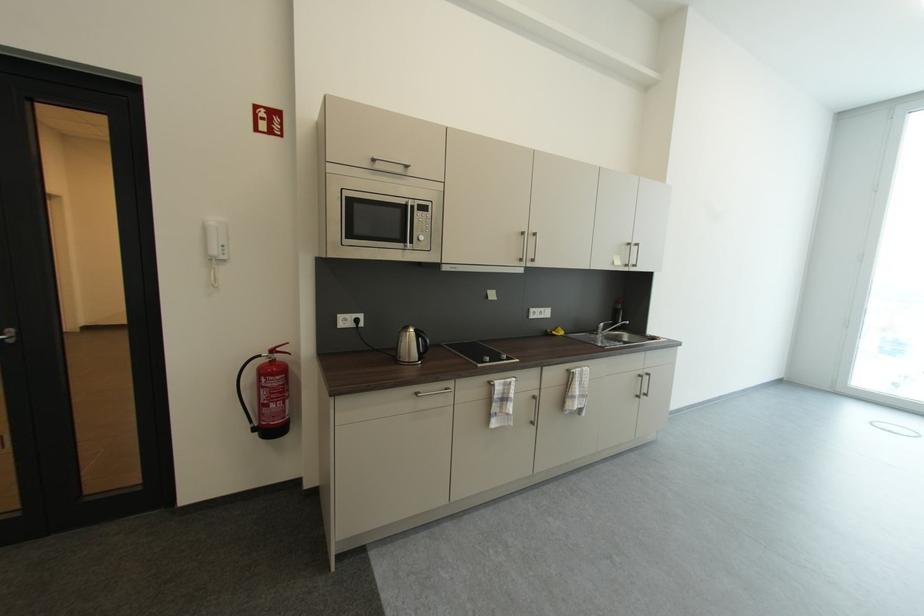
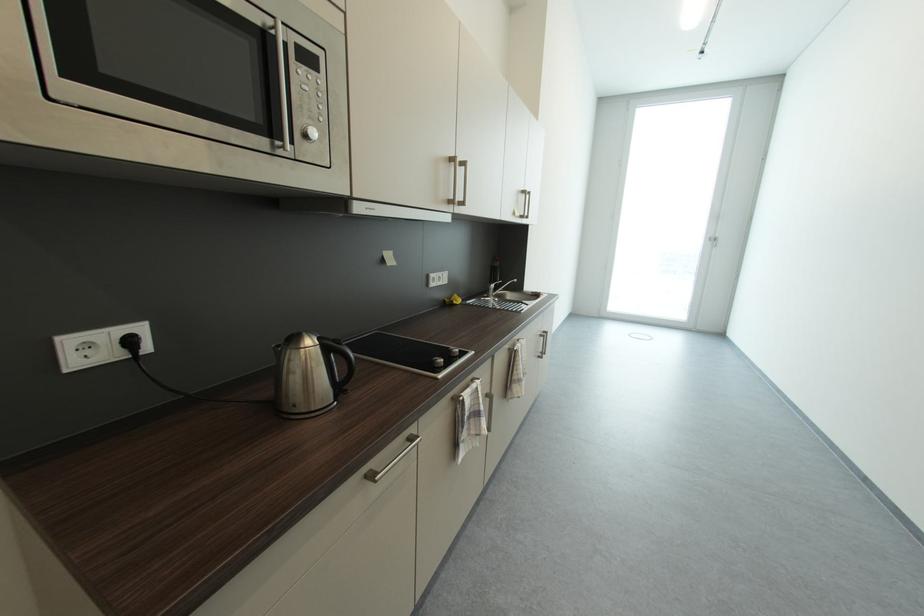
Where in the second image is the point corresponding to [363,322] from the first image?

(137, 344)